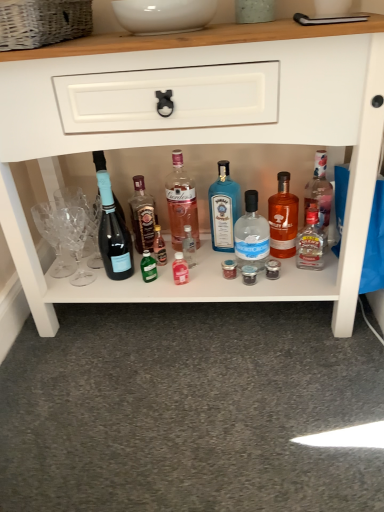
Question: In the image, is transparent glass bottle at center, arranged as the 5th bottle when viewed from the left, positioned in front of or behind pink glass bottle at center, positioned as the third bottle in left-to-right order?

Choices:
 (A) behind
 (B) front

Answer: (B)

Question: Do you think transparent glass bottle at center, the 3th bottle in the right-to-left sequence, is within pink glass bottle at center, placed as the fifth bottle when sorted from right to left, or outside of it?

Choices:
 (A) outside
 (B) inside

Answer: (A)

Question: Which object is positioned farthest from the black glass bottle at center, which is counted as the 7th bottle, starting from the right?

Choices:
 (A) white glossy shelf at center
 (B) translucent amber glass bottle at center-right, marked as the 2th bottle in a right-to-left arrangement
 (C) woven wicker basket at upper left
 (D) blue glass bottle at center, marked as the fourth bottle in a left-to-right arrangement
 (E) transparent glass bottle at center, the 3th bottle in the right-to-left sequence

Answer: (B)

Question: Which object is positioned farthest from the black glass bottle at center, which is counted as the first bottle, starting from the left?

Choices:
 (A) transparent glass bottle at center, arranged as the 5th bottle when viewed from the left
 (B) matte glass bottle at center, which appears as the second bottle when viewed from the left
 (C) translucent glass bottle at right, arranged as the 1th bottle when viewed from the right
 (D) pink glass bottle at center, positioned as the third bottle in left-to-right order
 (E) white glossy shelf at center

Answer: (C)